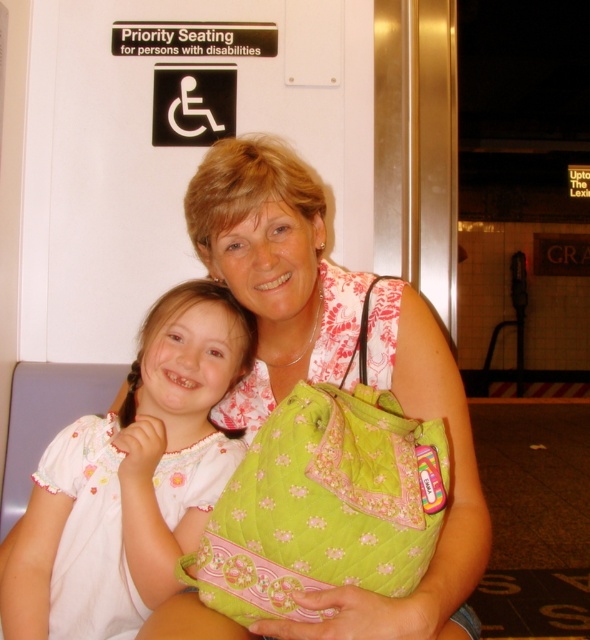
Question: Does white embroidered dress at center have a smaller size compared to green quilted shoulder bag at center?

Choices:
 (A) yes
 (B) no

Answer: (A)

Question: Can you confirm if white embroidered dress at center is thinner than green quilted shoulder bag at center?

Choices:
 (A) no
 (B) yes

Answer: (A)

Question: Which point appears closest to the camera in this image?

Choices:
 (A) (415, 504)
 (B) (236, 372)

Answer: (A)

Question: Can you confirm if white embroidered dress at center is thinner than green quilted shoulder bag at center?

Choices:
 (A) no
 (B) yes

Answer: (A)